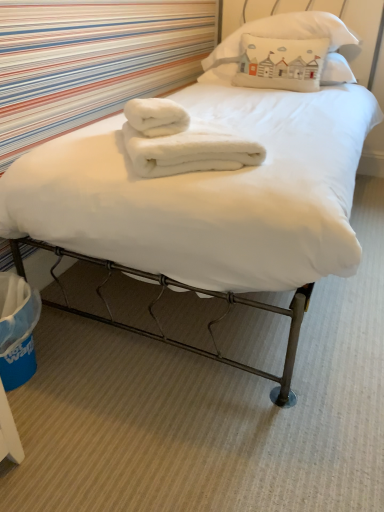
Question: Looking at the image, does white cotton pillow at upper center, the third pillow viewed from the top, seem bigger or smaller compared to white fluffy towel at center, arranged as the 1th bath towel when viewed from the top?

Choices:
 (A) small
 (B) big

Answer: (B)

Question: Relative to white fluffy towel at center, arranged as the 1th bath towel when viewed from the top, is white cotton pillow at upper center, the 1th pillow positioned from the bottom, in front or behind?

Choices:
 (A) front
 (B) behind

Answer: (B)

Question: Considering the real-world distances, which object is closest to the white fluffy bath towel at center, the first bath towel ordered from the bottom?

Choices:
 (A) white cotton pillow at upper center, the first pillow viewed from the top
 (B) white cotton pillow at upper center, the third pillow viewed from the top
 (C) white cotton pillow at upper center, which is the second pillow from top to bottom
 (D) white fluffy towel at center, which appears as the second bath towel when ordered from the bottom

Answer: (D)

Question: Which object is positioned farthest from the white cotton pillow at upper center, which ranks as the third pillow in bottom-to-top order?

Choices:
 (A) white cotton pillow at upper center, the 1th pillow positioned from the bottom
 (B) white fluffy bath towel at center, the first bath towel ordered from the bottom
 (C) white cotton pillow at upper center, which is the second pillow from top to bottom
 (D) white fluffy towel at center, which appears as the second bath towel when ordered from the bottom

Answer: (B)